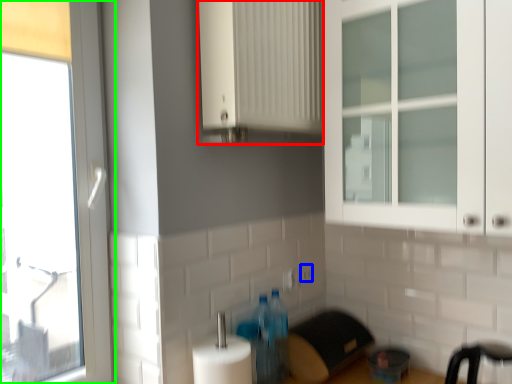
Question: Based on their relative distances, which object is farther from cabinetry (highlighted by a red box)? Choose from electric outlet (highlighted by a blue box) and window (highlighted by a green box).

Choices:
 (A) electric outlet
 (B) window

Answer: (A)